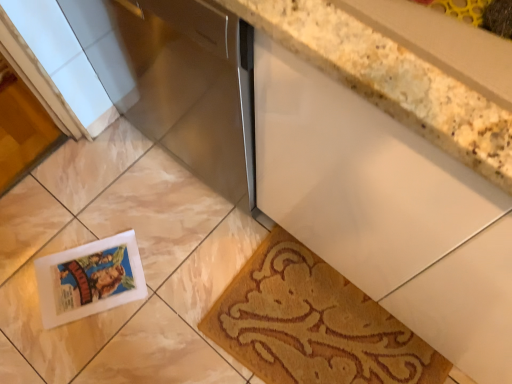
Image resolution: width=512 pixels, height=384 pixels. I want to click on white granite countertop at upper right, so click(391, 80).

The image size is (512, 384). What do you see at coordinates (178, 80) in the screenshot?
I see `satin silver dishwasher at center` at bounding box center [178, 80].

Where is `white granite countertop at upper right`? The height and width of the screenshot is (384, 512). white granite countertop at upper right is located at coordinates (391, 80).

From a real-world perspective, is white glossy postcard at lower left positioned above or below brown textured mat at lower right?

Clearly, from a real-world perspective, white glossy postcard at lower left is below brown textured mat at lower right.

Which is less distant, (99, 246) or (316, 362)?

Point (99, 246) appears to be farther away from the viewer than point (316, 362).

Considering the sizes of objects white glossy postcard at lower left and brown textured mat at lower right in the image provided, who is shorter, white glossy postcard at lower left or brown textured mat at lower right?

With less height is white glossy postcard at lower left.

Between white glossy postcard at lower left and brown textured mat at lower right, which one has larger size?

brown textured mat at lower right is bigger.

Is white glossy postcard at lower left at the left side of satin silver dishwasher at center?

Indeed, white glossy postcard at lower left is positioned on the left side of satin silver dishwasher at center.

Considering the points (105, 269) and (115, 41), which point is in front, point (105, 269) or point (115, 41)?

Point (115, 41)

From a real-world perspective, relative to satin silver dishwasher at center, is white glossy postcard at lower left vertically above or below?

Clearly, from a real-world perspective, white glossy postcard at lower left is below satin silver dishwasher at center.

Relative to satin silver dishwasher at center, is white glossy postcard at lower left in front or behind?

white glossy postcard at lower left is positioned farther from the viewer than satin silver dishwasher at center.

Is white granite countertop at upper right further to the viewer compared to brown textured mat at lower right?

No, white granite countertop at upper right is closer to the viewer.

Is white granite countertop at upper right situated inside brown textured mat at lower right or outside?

white granite countertop at upper right cannot be found inside brown textured mat at lower right.

Is white granite countertop at upper right facing towards brown textured mat at lower right?

No, white granite countertop at upper right is not aimed at brown textured mat at lower right.

Relative to satin silver dishwasher at center, is brown textured mat at lower right in front or behind?

brown textured mat at lower right is behind satin silver dishwasher at center.

Could you tell me if brown textured mat at lower right is facing satin silver dishwasher at center?

No, brown textured mat at lower right is not oriented towards satin silver dishwasher at center.

Is brown textured mat at lower right thinner than satin silver dishwasher at center?

Yes, brown textured mat at lower right is thinner than satin silver dishwasher at center.

Does brown textured mat at lower right lie behind white granite countertop at upper right?

Yes, brown textured mat at lower right is further from the viewer.

Is brown textured mat at lower right oriented towards white granite countertop at upper right?

No, brown textured mat at lower right does not turn towards white granite countertop at upper right.

From a real-world perspective, which object rests below the other?

brown textured mat at lower right is physically lower.

In the scene shown: How far apart are brown textured mat at lower right and white granite countertop at upper right?

The distance of brown textured mat at lower right from white granite countertop at upper right is 32.84 inches.

From a real-world perspective, who is located higher, white granite countertop at upper right or white glossy postcard at lower left?

From a 3D spatial view, white granite countertop at upper right is above.

From the image's perspective, is white granite countertop at upper right above or below white glossy postcard at lower left?

white granite countertop at upper right is above white glossy postcard at lower left.

Looking at this image, can you confirm if white granite countertop at upper right is wider than white glossy postcard at lower left?

Yes.

From their relative heights in the image, would you say white granite countertop at upper right is taller or shorter than white glossy postcard at lower left?

Clearly, white granite countertop at upper right is taller compared to white glossy postcard at lower left.

From a real-world perspective, is white granite countertop at upper right physically located above or below satin silver dishwasher at center?

Clearly, from a real-world perspective, white granite countertop at upper right is above satin silver dishwasher at center.

Relative to satin silver dishwasher at center, is white granite countertop at upper right in front or behind?

white granite countertop at upper right is positioned closer to the viewer than satin silver dishwasher at center.

Which is correct: white granite countertop at upper right is inside satin silver dishwasher at center, or outside of it?

The correct answer is: outside.

Which of these two, white granite countertop at upper right or satin silver dishwasher at center, is thinner?

Thinner between the two is white granite countertop at upper right.

Image resolution: width=512 pixels, height=384 pixels. Identify the location of postcard below the brown textured mat at lower right (from a real-world perspective). (90, 279).

Locate an element on the screen. Image resolution: width=512 pixels, height=384 pixels. appliance on the right of white glossy postcard at lower left is located at coordinates (178, 80).

Looking at the image, which one is located further to white granite countertop at upper right, satin silver dishwasher at center or brown textured mat at lower right?

Based on the image, brown textured mat at lower right appears to be further to white granite countertop at upper right.

When comparing their distances from brown textured mat at lower right, does satin silver dishwasher at center or white glossy postcard at lower left seem further?

Among the two, satin silver dishwasher at center is located further to brown textured mat at lower right.

Looking at the image, which one is located further to brown textured mat at lower right, satin silver dishwasher at center or white granite countertop at upper right?

white granite countertop at upper right is further to brown textured mat at lower right.

From the image, which object appears to be farther from satin silver dishwasher at center, white granite countertop at upper right or white glossy postcard at lower left?

The object further to satin silver dishwasher at center is white glossy postcard at lower left.

Estimate the real-world distances between objects in this image. Which object is further from white glossy postcard at lower left, satin silver dishwasher at center or white granite countertop at upper right?

The object further to white glossy postcard at lower left is white granite countertop at upper right.

Based on their spatial positions, is brown textured mat at lower right or white granite countertop at upper right closer to white glossy postcard at lower left?

brown textured mat at lower right lies closer to white glossy postcard at lower left than the other object.

When comparing their distances from satin silver dishwasher at center, does white glossy postcard at lower left or brown textured mat at lower right seem closer?

Among the two, brown textured mat at lower right is located nearer to satin silver dishwasher at center.

Based on their spatial positions, is satin silver dishwasher at center or brown textured mat at lower right further from white glossy postcard at lower left?

satin silver dishwasher at center is further to white glossy postcard at lower left.

Where is `mat between white glossy postcard at lower left and white granite countertop at upper right in the horizontal direction`? The width and height of the screenshot is (512, 384). mat between white glossy postcard at lower left and white granite countertop at upper right in the horizontal direction is located at coordinates (313, 324).

The image size is (512, 384). I want to click on appliance positioned between white granite countertop at upper right and white glossy postcard at lower left from near to far, so click(178, 80).

What are the coordinates of `postcard that lies between satin silver dishwasher at center and brown textured mat at lower right from top to bottom` in the screenshot? It's located at (90, 279).

Image resolution: width=512 pixels, height=384 pixels. I want to click on countertop between satin silver dishwasher at center and brown textured mat at lower right in the vertical direction, so click(x=391, y=80).